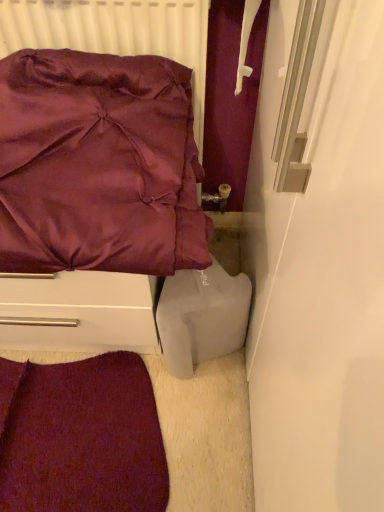
Question: Considering the positions of matte white radiator at upper left and velvet carpet at lower left in the image, is matte white radiator at upper left wider or thinner than velvet carpet at lower left?

Choices:
 (A) thin
 (B) wide

Answer: (A)

Question: From a real-world perspective, is matte white radiator at upper left physically located above or below velvet carpet at lower left?

Choices:
 (A) above
 (B) below

Answer: (A)

Question: Which object is positioned farthest from the white matte plastic container at lower right?

Choices:
 (A) matte white radiator at upper left
 (B) satin purple pillow at upper left
 (C) velvet carpet at lower left

Answer: (A)

Question: Which object is positioned closest to the white matte plastic container at lower right?

Choices:
 (A) matte white radiator at upper left
 (B) satin purple pillow at upper left
 (C) velvet carpet at lower left

Answer: (B)